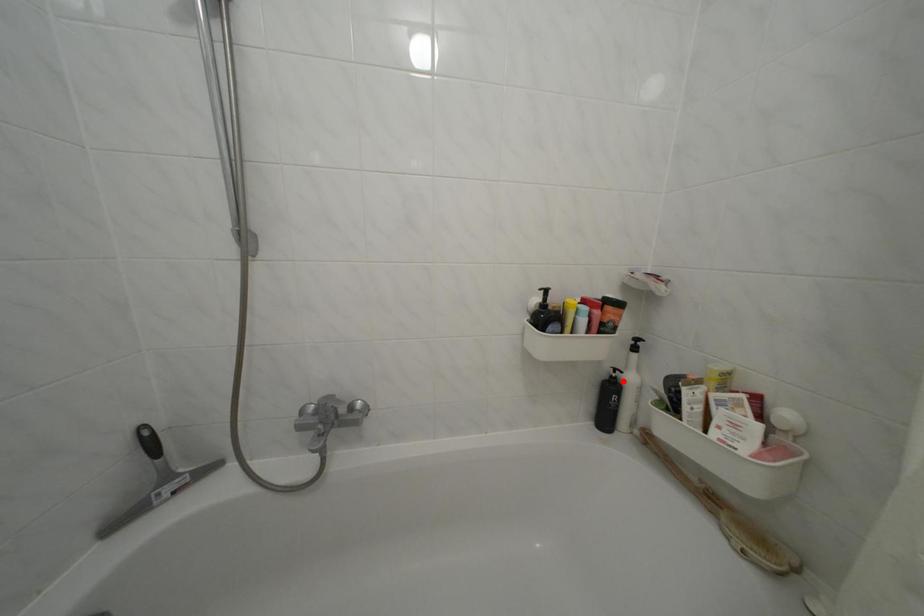
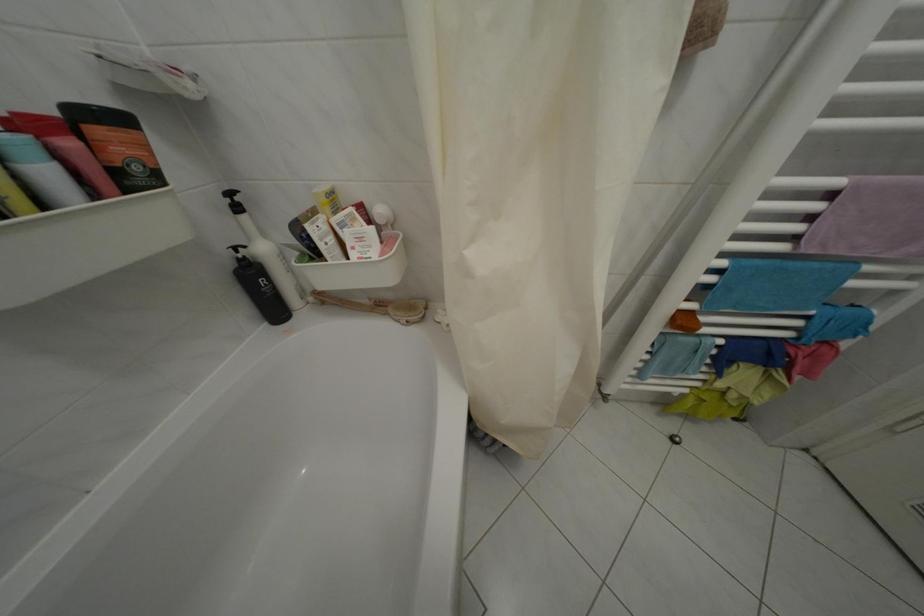
Question: I am providing you with two images of the same scene from different viewpoints. In image1, a red point is highlighted. Considering the same 3D point in image2, which of the following is correct?

Choices:
 (A) It is closer
 (B) It is farther

Answer: (A)